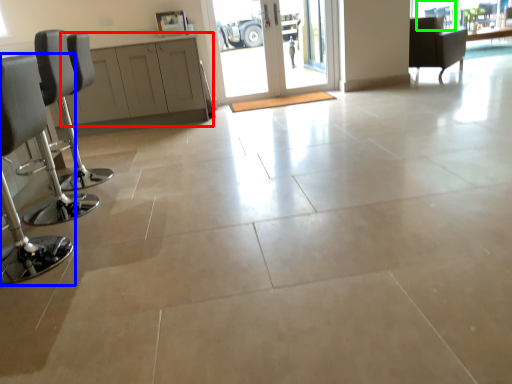
Question: Which is nearer to the cabinetry (highlighted by a red box)? chair (highlighted by a blue box) or window (highlighted by a green box).

Choices:
 (A) chair
 (B) window

Answer: (A)